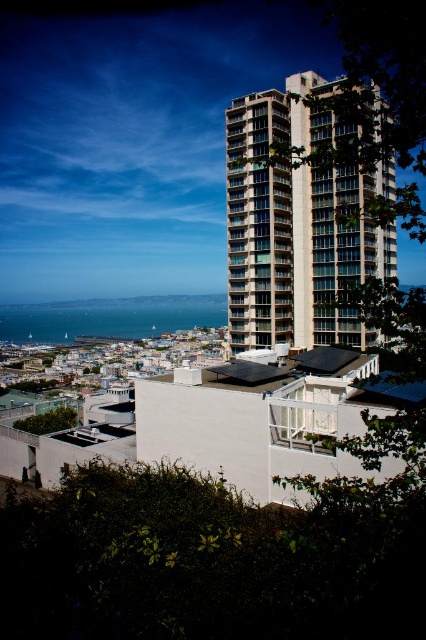
Question: Is beige concrete building at center below blue water at lower left?

Choices:
 (A) yes
 (B) no

Answer: (B)

Question: Can you confirm if beige concrete building at center is smaller than blue water at lower left?

Choices:
 (A) yes
 (B) no

Answer: (A)

Question: From the image, what is the correct spatial relationship of beige concrete building at center in relation to blue water at lower left?

Choices:
 (A) above
 (B) below

Answer: (A)

Question: Among these points, which one is nearest to the camera?

Choices:
 (A) (42, 323)
 (B) (314, 298)

Answer: (B)